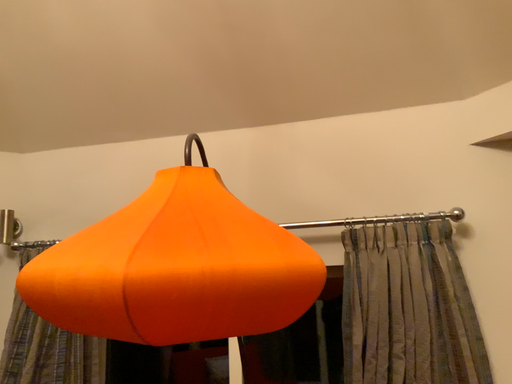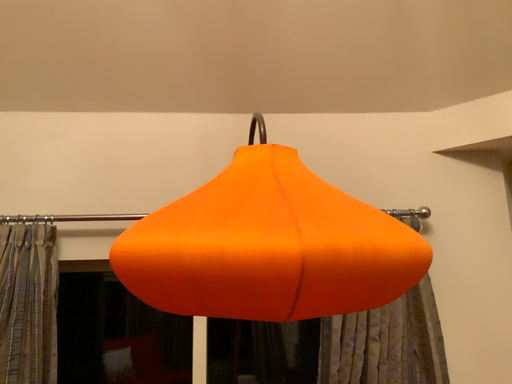
Question: Which way did the camera rotate in the video?

Choices:
 (A) rotated right
 (B) rotated left

Answer: (A)